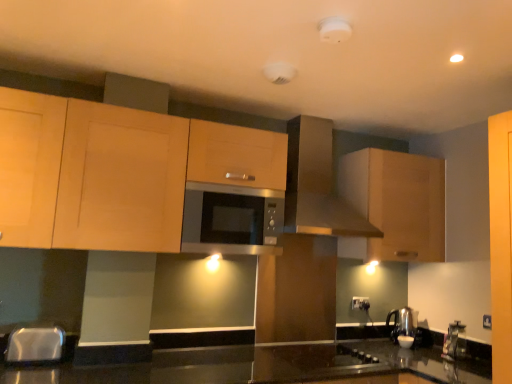
Where is `vacant space situated above matte brown range hood at upper center (from a real-world perspective)`? This screenshot has height=384, width=512. vacant space situated above matte brown range hood at upper center (from a real-world perspective) is located at coordinates tap(319, 110).